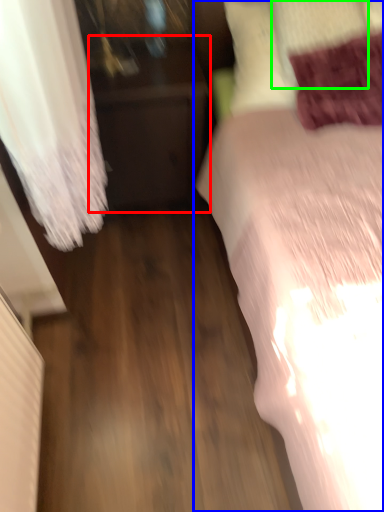
Question: Estimate the real-world distances between objects in this image. Which object is farther from furniture (highlighted by a red box), bed (highlighted by a blue box) or pillow (highlighted by a green box)?

Choices:
 (A) bed
 (B) pillow

Answer: (B)